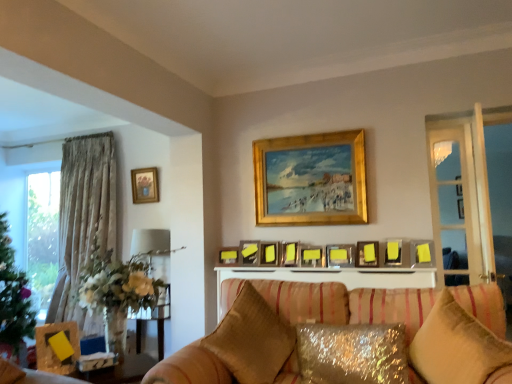
How much space does yellow matte picture frame at upper center, arranged as the 2th picture frame when viewed from the front, occupy vertically?

6.35 inches.

What do you see at coordinates (54, 347) in the screenshot? This screenshot has width=512, height=384. I see `wooden picture frame at left, which ranks as the 11th picture frame in right-to-left order` at bounding box center [54, 347].

Where is `gold wooden picture frame at upper center, the seventh picture frame when ordered from back to front`? The width and height of the screenshot is (512, 384). gold wooden picture frame at upper center, the seventh picture frame when ordered from back to front is located at coordinates [311, 179].

The image size is (512, 384). I want to click on metallic silver picture frame at center, which is the 5th picture frame in right-to-left order, so click(x=311, y=256).

Image resolution: width=512 pixels, height=384 pixels. What do you see at coordinates (249, 252) in the screenshot? I see `yellow matte picture frame at center, the 4th picture frame in the left-to-right sequence` at bounding box center [249, 252].

What are the coordinates of `metallic silver picture frame at center, the 11th picture frame when ordered from front to back` in the screenshot? It's located at (228, 255).

Is yellow matte picture frame at upper center, placed as the first picture frame when sorted from right to left, with metallic silver picture frame at center, which is counted as the 3th picture frame, starting from the left?

They are not placed beside each other.

In terms of height, does yellow matte picture frame at upper center, which is the 11th picture frame from back to front, look taller or shorter compared to metallic silver picture frame at center, acting as the second picture frame starting from the back?

Clearly, yellow matte picture frame at upper center, which is the 11th picture frame from back to front, is taller compared to metallic silver picture frame at center, acting as the second picture frame starting from the back.

From the metallic silver picture frame at center, arranged as the tenth picture frame when viewed from the right, count 9th picture frame to the right and point to it. Please provide its 2D coordinates.

[(422, 253)]

From the image's perspective, is yellow matte picture frame at upper center, placed as the first picture frame when sorted from right to left, above or below metallic silver picture frame at center, the 11th picture frame when ordered from front to back?

Based on their image positions, yellow matte picture frame at upper center, placed as the first picture frame when sorted from right to left, is located above metallic silver picture frame at center, the 11th picture frame when ordered from front to back.

Does metallic silver picture frame at center, the fifth picture frame in the front-to-back sequence, have a lesser height compared to metallic silver picture frame at center, the 10th picture frame in the left-to-right sequence?

Yes, metallic silver picture frame at center, the fifth picture frame in the front-to-back sequence, is shorter than metallic silver picture frame at center, the 10th picture frame in the left-to-right sequence.

Is metallic silver picture frame at center, the 8th picture frame positioned from the back, next to metallic silver picture frame at center, the 10th picture frame in the left-to-right sequence, and touching it?

No, metallic silver picture frame at center, the 8th picture frame positioned from the back, is not touching metallic silver picture frame at center, the 10th picture frame in the left-to-right sequence.

Between point (353, 255) and point (366, 255), which one is positioned in front?

Point (366, 255)

Is metallic silver picture frame at center, the fifth picture frame in the front-to-back sequence, behind metallic silver picture frame at center, the 9th picture frame when ordered from back to front?

Yes, it is.

Visually, is metallic silver picture frame at center, the 6th picture frame when ordered from left to right, positioned to the left or to the right of metallic silver picture frame at center, which is the 6th picture frame from back to front?

Clearly, metallic silver picture frame at center, the 6th picture frame when ordered from left to right, is on the left of metallic silver picture frame at center, which is the 6th picture frame from back to front, in the image.

Is metallic silver picture frame at center, the eighth picture frame viewed from the front, shorter than metallic silver picture frame at center, which is the 5th picture frame in right-to-left order?

No, metallic silver picture frame at center, the eighth picture frame viewed from the front, is not shorter than metallic silver picture frame at center, which is the 5th picture frame in right-to-left order.

In the scene shown: Is metallic silver picture frame at center, which ranks as the fifth picture frame in back-to-front order, located outside metallic silver picture frame at center, which is the 6th picture frame from back to front?

That's correct, metallic silver picture frame at center, which ranks as the fifth picture frame in back-to-front order, is outside of metallic silver picture frame at center, which is the 6th picture frame from back to front.

What's the angular difference between metallic silver picture frame at center, the 6th picture frame when ordered from left to right, and metallic silver picture frame at center, which is the 6th picture frame from back to front,'s facing directions?

The facing directions of metallic silver picture frame at center, the 6th picture frame when ordered from left to right, and metallic silver picture frame at center, which is the 6th picture frame from back to front, are 5.05 degrees apart.

Considering the relative sizes of gold-framed picture at upper left, which appears as the 1th picture frame when viewed from the left, and metallic silver picture frame at center, the third picture frame viewed from the right, in the image provided, is gold-framed picture at upper left, which appears as the 1th picture frame when viewed from the left, shorter than metallic silver picture frame at center, the third picture frame viewed from the right,?

Incorrect, the height of gold-framed picture at upper left, which appears as the 1th picture frame when viewed from the left, does not fall short of that of metallic silver picture frame at center, the third picture frame viewed from the right.

Could you tell me if gold-framed picture at upper left, acting as the 1th picture frame starting from the back, is turned towards metallic silver picture frame at center, the third picture frame viewed from the right?

No, gold-framed picture at upper left, acting as the 1th picture frame starting from the back, is not turned towards metallic silver picture frame at center, the third picture frame viewed from the right.

Considering the sizes of gold-framed picture at upper left, which appears as the 12th picture frame when viewed from the front, and metallic silver picture frame at center, which is counted as the 4th picture frame, starting from the front, in the image, is gold-framed picture at upper left, which appears as the 12th picture frame when viewed from the front, wider or thinner than metallic silver picture frame at center, which is counted as the 4th picture frame, starting from the front,?

gold-framed picture at upper left, which appears as the 12th picture frame when viewed from the front, is thinner than metallic silver picture frame at center, which is counted as the 4th picture frame, starting from the front.

Considering the sizes of objects gold-framed picture at upper left, acting as the 1th picture frame starting from the back, and metallic silver picture frame at center, the 9th picture frame when ordered from back to front, in the image provided, who is bigger, gold-framed picture at upper left, acting as the 1th picture frame starting from the back, or metallic silver picture frame at center, the 9th picture frame when ordered from back to front,?

With larger size is gold-framed picture at upper left, acting as the 1th picture frame starting from the back.

From the image's perspective, is matte yellow picture frame at center, which is counted as the fifth picture frame, starting from the left, below yellow matte picture frame at center, the 10th picture frame when ordered from back to front?

Indeed, from the image's perspective, matte yellow picture frame at center, which is counted as the fifth picture frame, starting from the left, is shown beneath yellow matte picture frame at center, the 10th picture frame when ordered from back to front.

From the yellow matte picture frame at center, the 10th picture frame when ordered from back to front, count 6th picture frames backward and point to it. Please provide its 2D coordinates.

[(269, 254)]

Is point (272, 261) closer to camera compared to point (394, 242)?

That is False.

Consider the image. Is yellow matte picture frame at upper center, arranged as the 2th picture frame when viewed from the front, beside metallic silver picture frame at center, the fifth picture frame in the front-to-back sequence?

No, yellow matte picture frame at upper center, arranged as the 2th picture frame when viewed from the front, is not making contact with metallic silver picture frame at center, the fifth picture frame in the front-to-back sequence.

Based on the photo, who is taller, yellow matte picture frame at upper center, arranged as the 2th picture frame when viewed from the front, or metallic silver picture frame at center, the fifth picture frame in the front-to-back sequence?

yellow matte picture frame at upper center, arranged as the 2th picture frame when viewed from the front.

Is point (421, 253) positioned after point (350, 253)?

No, it is not.

From a real-world perspective, is metallic silver picture frame at center, the eighth picture frame viewed from the front, over velvet beige pillow at lower right, the third pillow from the left?

Yes, from a real-world perspective, metallic silver picture frame at center, the eighth picture frame viewed from the front, is on top of velvet beige pillow at lower right, the third pillow from the left.

Could you tell me if metallic silver picture frame at center, the 6th picture frame when ordered from left to right, is facing velvet beige pillow at lower right, the third pillow from the left?

No, metallic silver picture frame at center, the 6th picture frame when ordered from left to right, is not oriented towards velvet beige pillow at lower right, the third pillow from the left.

From the image's perspective, is metallic silver picture frame at center, the 6th picture frame when ordered from left to right, below velvet beige pillow at lower right, the third pillow from the left?

No, from the image's perspective, metallic silver picture frame at center, the 6th picture frame when ordered from left to right, is not below velvet beige pillow at lower right, the third pillow from the left.

What's the angular difference between metallic silver picture frame at center, the eighth picture frame viewed from the front, and velvet beige pillow at lower right, the third pillow from the left,'s facing directions?

They differ by 34.4 degrees in their facing directions.

From the yellow matte picture frame at upper center, arranged as the 2th picture frame when viewed from the front, count 9th picture frames backward and point to it. Please provide its 2D coordinates.

[(228, 255)]

From the image's perspective, which picture frame is the 3rd one below the metallic silver picture frame at center, the 9th picture frame when ordered from back to front? Please provide its 2D coordinates.

[(340, 255)]

From the image, which object appears to be farther from metallic silver picture frame at center, which is the 5th picture frame in right-to-left order, gold-framed picture at upper left, which appears as the 12th picture frame when viewed from the front, or yellow matte picture frame at upper center, arranged as the 2th picture frame when viewed from the front?

gold-framed picture at upper left, which appears as the 12th picture frame when viewed from the front, is positioned further to the anchor metallic silver picture frame at center, which is the 5th picture frame in right-to-left order.

Considering their positions, is gold wooden picture frame at upper center, marked as the 6th picture frame in a front-to-back arrangement, positioned further to metallic silver picture frame at center, the 9th picture frame viewed from the left, than sparkly gold pillow at lower center, which appears as the second pillow when viewed from the right?

The object further to metallic silver picture frame at center, the 9th picture frame viewed from the left, is sparkly gold pillow at lower center, which appears as the second pillow when viewed from the right.

From the image, which object appears to be farther from matte yellow picture frame at center, the 8th picture frame from the right, satin gold pillow at lower center, marked as the third pillow in a right-to-left arrangement, or metallic silver picture frame at center, the eighth picture frame viewed from the front?

satin gold pillow at lower center, marked as the third pillow in a right-to-left arrangement.

From the image, which object appears to be farther from yellow matte picture frame at upper center, which is the 11th picture frame from back to front, satin gold pillow at lower center, which is counted as the first pillow, starting from the left, or metallic silver picture frame at center, which is the 6th picture frame from back to front?

satin gold pillow at lower center, which is counted as the first pillow, starting from the left, is further to yellow matte picture frame at upper center, which is the 11th picture frame from back to front.

When comparing their distances from velvet beige pillow at lower right, the first pillow viewed from the right, does gold-framed picture at upper left, acting as the 1th picture frame starting from the back, or gold wooden picture frame at upper center, marked as the 6th picture frame in a front-to-back arrangement, seem closer?

gold wooden picture frame at upper center, marked as the 6th picture frame in a front-to-back arrangement.

Based on their spatial positions, is metallic silver picture frame at center, the 10th picture frame in the left-to-right sequence, or satin gold pillow at lower center, marked as the third pillow in a right-to-left arrangement, further from gold wooden picture frame at upper center, which is the seventh picture frame from left to right?

Based on the image, satin gold pillow at lower center, marked as the third pillow in a right-to-left arrangement, appears to be further to gold wooden picture frame at upper center, which is the seventh picture frame from left to right.

Considering their positions, is matte yellow picture frame at center, which is counted as the fifth picture frame, starting from the left, positioned closer to yellow matte picture frame at center, which appears as the 9th picture frame when viewed from the right, than yellow matte picture frame at upper center, arranged as the 2th picture frame when viewed from the front?

matte yellow picture frame at center, which is counted as the fifth picture frame, starting from the left.

Considering their positions, is velvet beige pillow at lower right, the first pillow viewed from the right, positioned closer to metallic silver picture frame at center, the 6th picture frame when ordered from left to right, than satin gold pillow at lower center, marked as the third pillow in a right-to-left arrangement?

Among the two, satin gold pillow at lower center, marked as the third pillow in a right-to-left arrangement, is located nearer to metallic silver picture frame at center, the 6th picture frame when ordered from left to right.

Where is `picture frame situated between metallic silver picture frame at center, arranged as the tenth picture frame when viewed from the right, and matte yellow picture frame at center, the 8th picture frame from the right, from left to right`? picture frame situated between metallic silver picture frame at center, arranged as the tenth picture frame when viewed from the right, and matte yellow picture frame at center, the 8th picture frame from the right, from left to right is located at coordinates (249, 252).

Identify the location of pillow between sparkly gold pillow at lower center, which appears as the second pillow when viewed from the right, and metallic silver picture frame at center, the 11th picture frame when ordered from front to back, in the front-back direction. The width and height of the screenshot is (512, 384). (252, 339).

Locate an element on the screen. This screenshot has height=384, width=512. pillow positioned between sparkly gold pillow at lower center, which appears as the second pillow when viewed from the right, and yellow matte picture frame at center, the 4th picture frame in the left-to-right sequence, from near to far is located at coordinates (252, 339).

You are a GUI agent. You are given a task and a screenshot of the screen. Output one action in this format:
    pyautogui.click(x=<x>, y=<y>)
    Task: Click on the pillow situated between satin gold pillow at lower center, which is counted as the first pillow, starting from the left, and velvet beige pillow at lower right, the third pillow from the left, from left to right
    This screenshot has width=512, height=384.
    Given the screenshot: What is the action you would take?
    pyautogui.click(x=352, y=354)